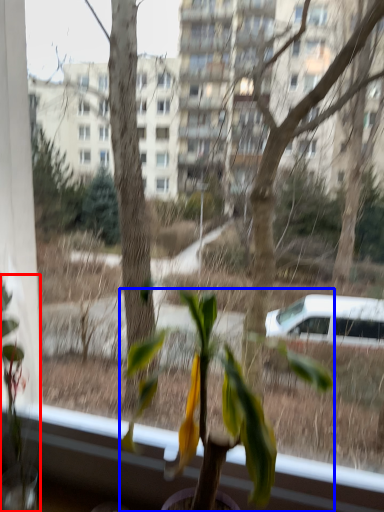
Question: Among these objects, which one is nearest to the camera, houseplant (highlighted by a red box) or houseplant (highlighted by a blue box)?

Choices:
 (A) houseplant
 (B) houseplant

Answer: (B)